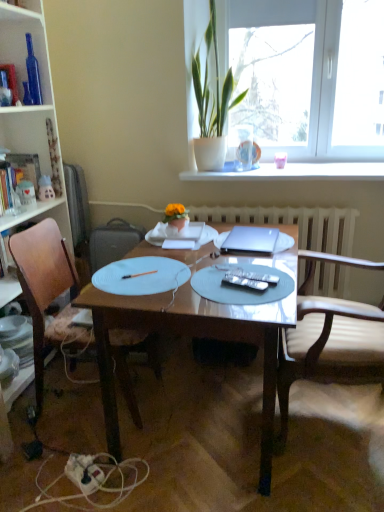
Locate an element on the screen. The image size is (384, 512). blank area to the left of white paper notebook at center is located at coordinates (144, 250).